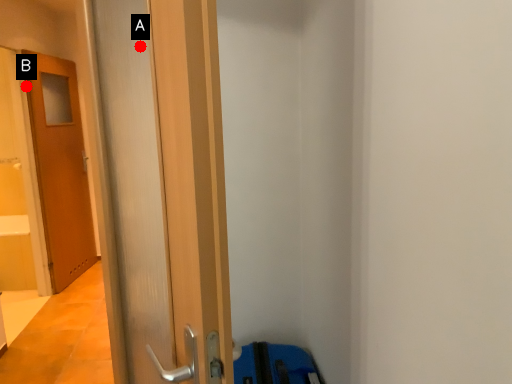
Question: Two points are circled on the image, labeled by A and B beside each circle. Which point appears closest to the camera in this image?

Choices:
 (A) A is closer
 (B) B is closer

Answer: (A)